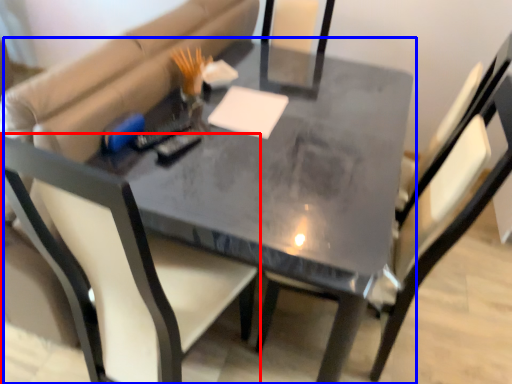
Question: Among these objects, which one is nearest to the camera, chair (highlighted by a red box) or table (highlighted by a blue box)?

Choices:
 (A) chair
 (B) table

Answer: (A)